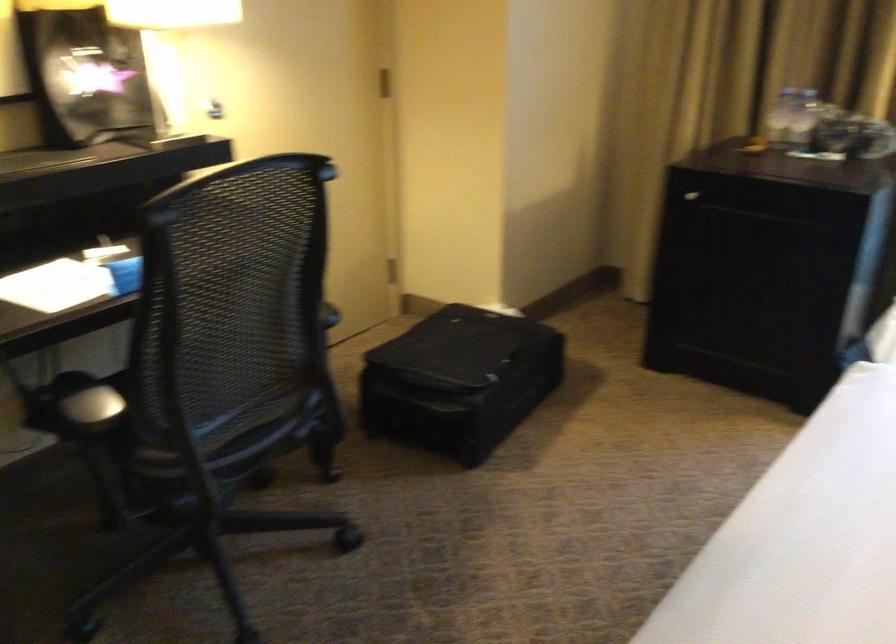
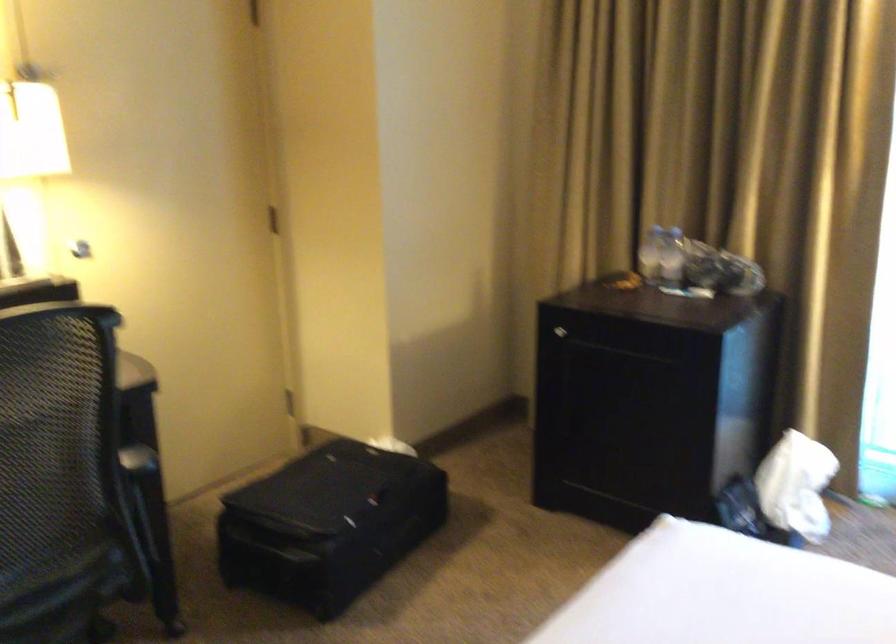
The point at (776, 116) is marked in the first image. Where is the corresponding point in the second image?

(650, 252)